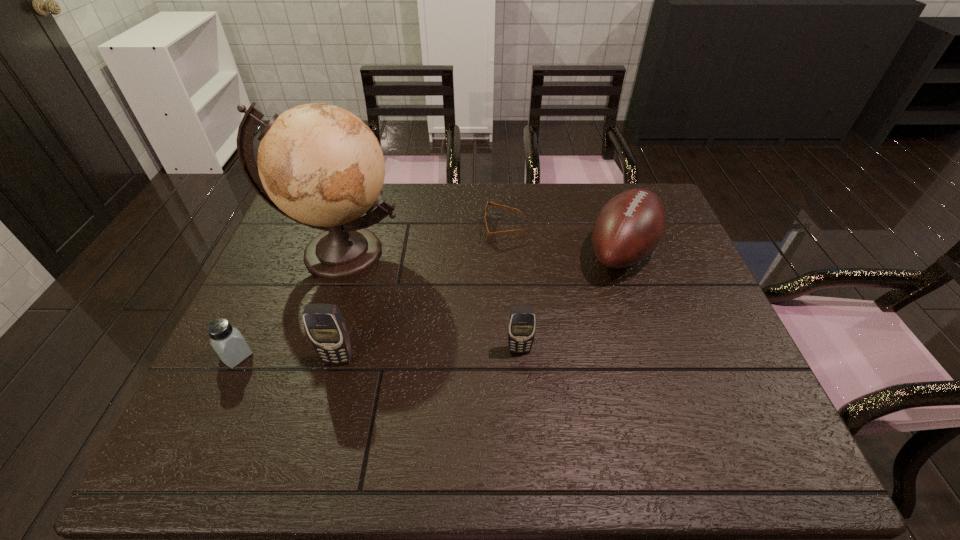
Where is `the left cellular telephone`? the left cellular telephone is located at coordinates (325, 325).

At what (x,y) coordinates should I click in order to perform the action: click on the shorter cellular telephone. Please return your answer as a coordinate pair (x, y). This screenshot has height=540, width=960. Looking at the image, I should click on (522, 319).

Identify the location of the right cellular telephone. (522, 319).

Image resolution: width=960 pixels, height=540 pixels. In order to click on sunglasses in this screenshot , I will do `click(486, 232)`.

Locate an element on the screen. globe is located at coordinates (320, 165).

In order to click on the rightmost object in this screenshot , I will do `click(629, 227)`.

Identify the location of the second shortest object. The image size is (960, 540). (227, 341).

The width and height of the screenshot is (960, 540). What are the coordinates of `vacant space located on the front face of the left cellular telephone` in the screenshot? It's located at (326, 405).

At what (x,y) coordinates should I click in order to perform the action: click on vacant space located on the front face of the shorter cellular telephone. Please return your answer as a coordinate pair (x, y). Looking at the image, I should click on (523, 400).

Where is `free region located on the frames of the sunglasses`? Image resolution: width=960 pixels, height=540 pixels. free region located on the frames of the sunglasses is located at coordinates (388, 229).